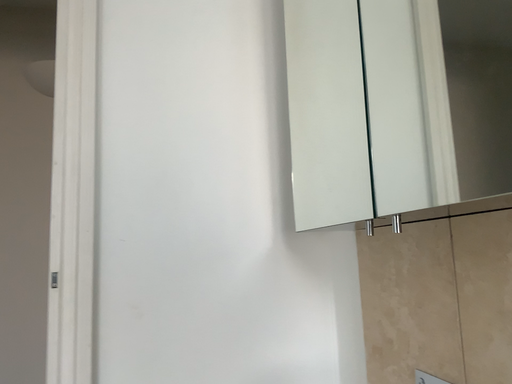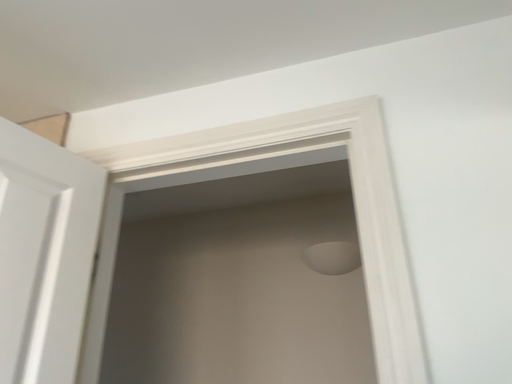
Question: How did the camera likely rotate when shooting the video?

Choices:
 (A) rotated upward
 (B) rotated downward

Answer: (A)